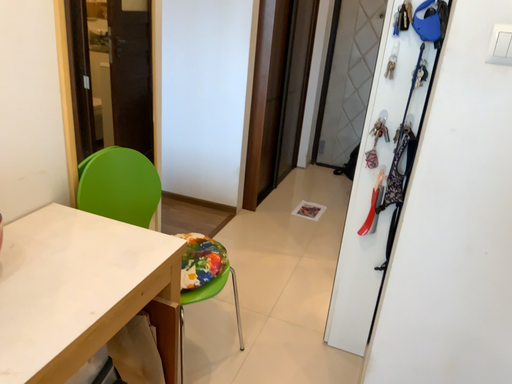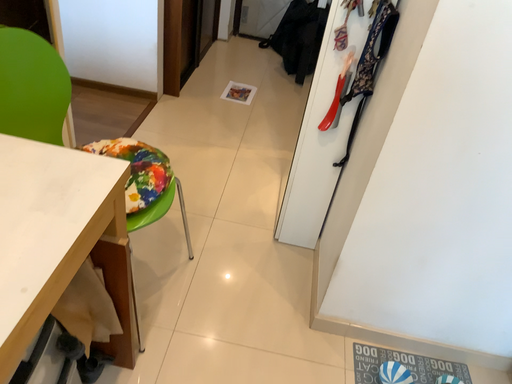
Question: Which way did the camera rotate in the video?

Choices:
 (A) rotated left
 (B) rotated right

Answer: (B)